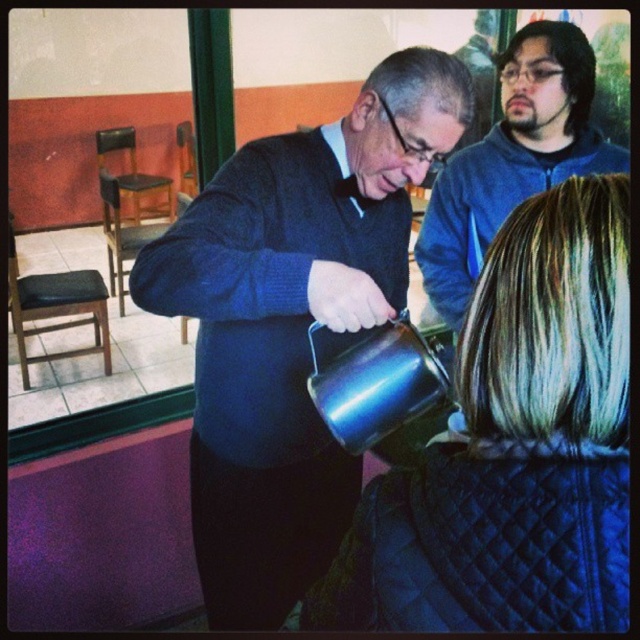
Question: From the image, what is the correct spatial relationship of black quilted jacket at lower right in relation to blue fleece jacket at upper right?

Choices:
 (A) right
 (B) left

Answer: (B)

Question: Does metallic blue kettle at center have a larger size compared to black quilted jacket at lower right?

Choices:
 (A) no
 (B) yes

Answer: (B)

Question: Does metallic blue kettle at center appear over blue fleece jacket at upper right?

Choices:
 (A) yes
 (B) no

Answer: (B)

Question: Which object is closer to the camera taking this photo?

Choices:
 (A) metallic blue kettle at center
 (B) black quilted jacket at lower right
 (C) blue fleece jacket at upper right

Answer: (B)

Question: Based on their relative distances, which object is nearer to the metallic blue kettle at center?

Choices:
 (A) blue fleece jacket at upper right
 (B) black quilted jacket at lower right

Answer: (B)

Question: Which of these objects is positioned closest to the black quilted jacket at lower right?

Choices:
 (A) blue fleece jacket at upper right
 (B) metallic blue kettle at center

Answer: (B)